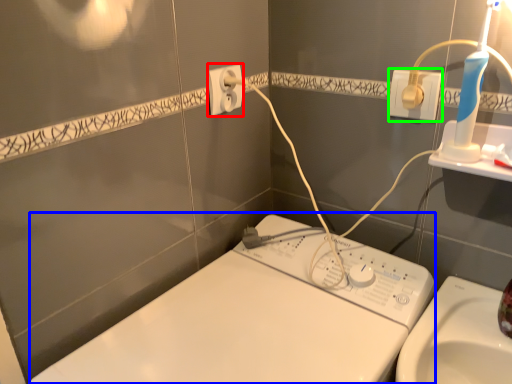
Question: Which is nearer to the power plugs and sockets (highlighted by a red box)? machine (highlighted by a blue box) or power plugs and sockets (highlighted by a green box).

Choices:
 (A) machine
 (B) power plugs and sockets

Answer: (B)